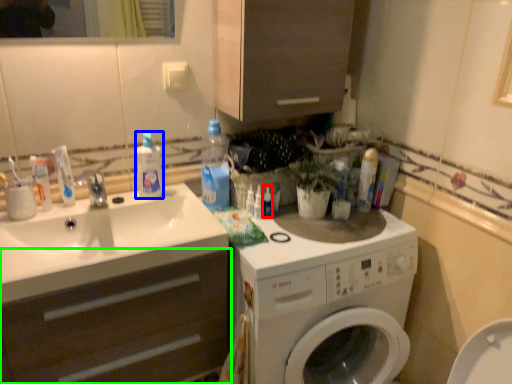
Question: Which is nearer to the toiletry (highlighted by a red box)? cleaning product (highlighted by a blue box) or bathroom cabinet (highlighted by a green box).

Choices:
 (A) cleaning product
 (B) bathroom cabinet

Answer: (A)